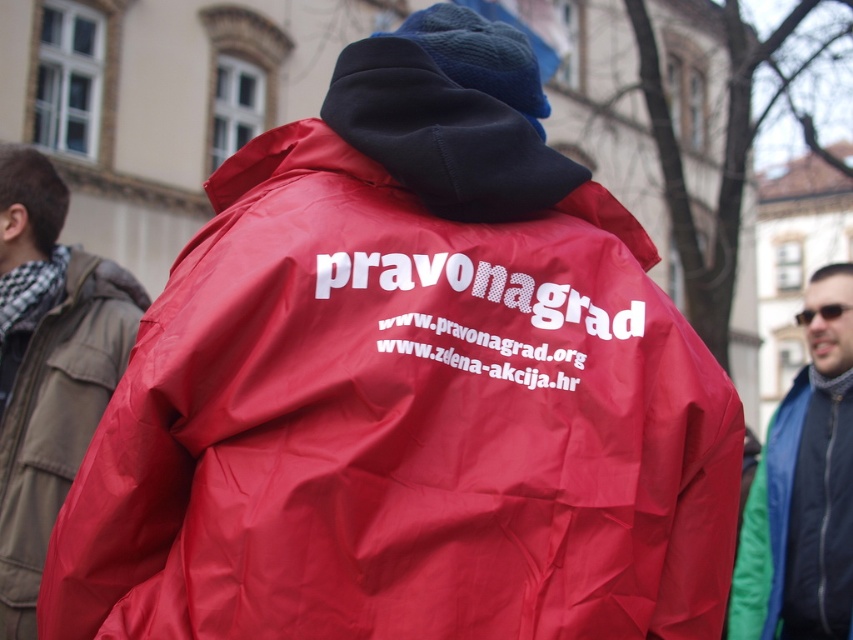
Does matte nylon jacket at center have a smaller size compared to shiny blue jacket at right?

Yes, matte nylon jacket at center is smaller than shiny blue jacket at right.

The image size is (853, 640). I want to click on matte nylon jacket at center, so click(x=401, y=426).

Which of these two, shiny blue jacket at right or sunglasses at center, stands shorter?

With less height is sunglasses at center.

Who is more forward, (782,401) or (804,310)?

Point (782,401) is more forward.

What do you see at coordinates (802, 504) in the screenshot?
I see `shiny blue jacket at right` at bounding box center [802, 504].

This screenshot has height=640, width=853. I want to click on shiny blue jacket at right, so click(x=802, y=504).

Who is higher up, matte red jacket at center or sunglasses at center?

Positioned higher is sunglasses at center.

Does matte red jacket at center have a larger size compared to sunglasses at center?

Incorrect, matte red jacket at center is not larger than sunglasses at center.

Between point (16, 540) and point (817, 310), which one is positioned behind?

The point (817, 310) is more distant.

Where is `matte red jacket at center`? The height and width of the screenshot is (640, 853). matte red jacket at center is located at coordinates (48, 368).